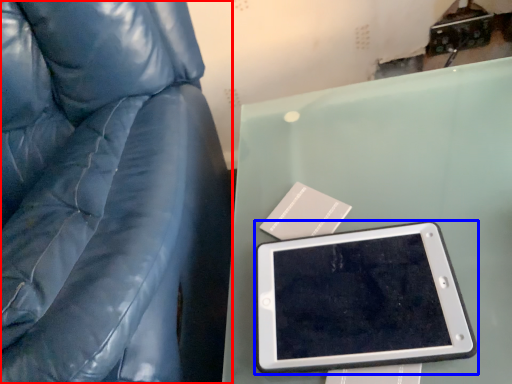
Question: Which object appears farthest to the camera in this image, furniture (highlighted by a red box) or tablet computer (highlighted by a blue box)?

Choices:
 (A) furniture
 (B) tablet computer

Answer: (B)